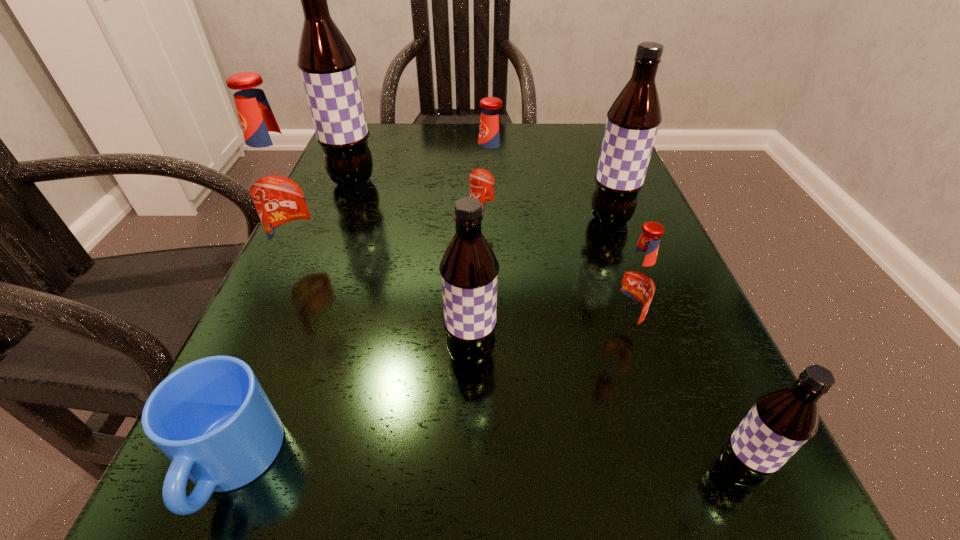
At what (x,y) coordinates should I click in order to perform the action: click on free location that satisfies the following two spatial constraints: 1. on the back side of the second farthest brown root beer; 2. on the left side of the second smallest red root beer. Please return your answer as a coordinate pair (x, y). This screenshot has height=540, width=960. Looking at the image, I should click on (489, 219).

Identify the location of vacant space that satisfies the following two spatial constraints: 1. on the side of the nearest brown root beer with the handle; 2. on the right side of the shortest object. (228, 472).

This screenshot has width=960, height=540. I want to click on free region that satisfies the following two spatial constraints: 1. on the back side of the second farthest brown root beer; 2. on the right side of the second smallest brown root beer, so click(473, 219).

Find the location of a particular element. This screenshot has height=540, width=960. free space that satisfies the following two spatial constraints: 1. on the front side of the biggest red root beer; 2. on the right side of the third biggest brown root beer is located at coordinates (267, 354).